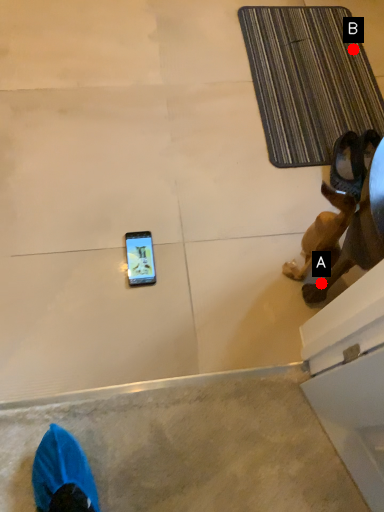
Question: Two points are circled on the image, labeled by A and B beside each circle. Which point appears closest to the camera in this image?

Choices:
 (A) A is closer
 (B) B is closer

Answer: (A)